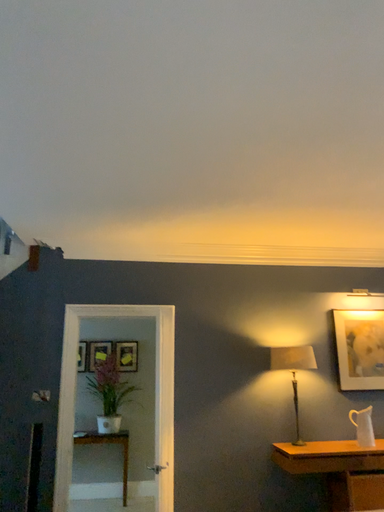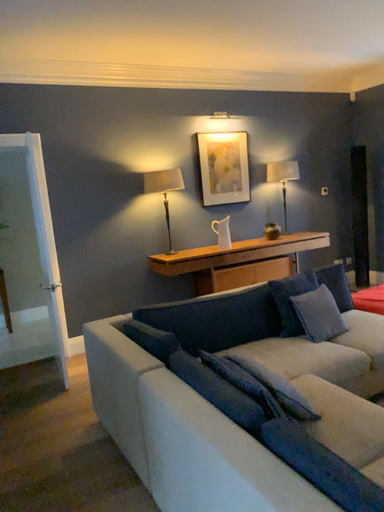
Question: Which way did the camera rotate in the video?

Choices:
 (A) rotated right
 (B) rotated left

Answer: (A)